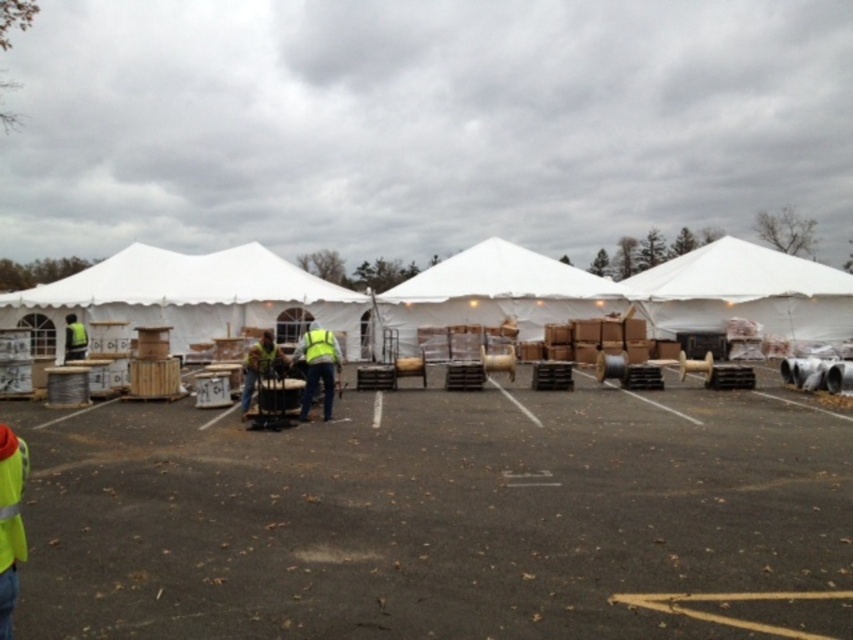
Can you confirm if white fabric tent at center is shorter than reflective yellow vest at center?

In fact, white fabric tent at center may be taller than reflective yellow vest at center.

Who is more forward, (496,244) or (306,396)?

Point (306,396) is in front.

Which is behind, point (448, 305) or point (316, 339)?

The point (448, 305) is more distant.

Where is `white fabric tent at center`? white fabric tent at center is located at coordinates (496, 292).

Can you confirm if black asphalt parking lot at center is positioned below yellow reflective safety vest at center?

Yes.

Does black asphalt parking lot at center have a smaller size compared to yellow reflective safety vest at center?

No, black asphalt parking lot at center is not smaller than yellow reflective safety vest at center.

Between point (534, 616) and point (312, 344), which one is positioned in front?

Point (534, 616) is in front.

Identify the location of black asphalt parking lot at center. The height and width of the screenshot is (640, 853). [440, 516].

Can you confirm if black asphalt parking lot at center is positioned above white fabric canopy at left?

No, black asphalt parking lot at center is not above white fabric canopy at left.

Who is taller, black asphalt parking lot at center or white fabric canopy at left?

white fabric canopy at left is taller.

Is point (79, 424) positioned after point (144, 292)?

No.

Where is `black asphalt parking lot at center`? The width and height of the screenshot is (853, 640). black asphalt parking lot at center is located at coordinates [440, 516].